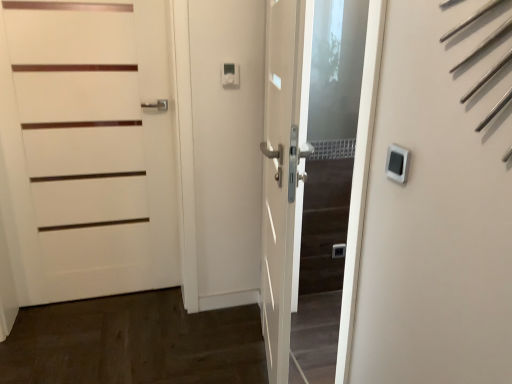
Question: Considering the positions of white matte door at center, the second door in the left-to-right sequence, and white plastic thermostat at upper right in the image, is white matte door at center, the second door in the left-to-right sequence, taller or shorter than white plastic thermostat at upper right?

Choices:
 (A) short
 (B) tall

Answer: (B)

Question: In terms of size, does white matte door at center, the second door in the left-to-right sequence, appear bigger or smaller than white plastic thermostat at upper right?

Choices:
 (A) small
 (B) big

Answer: (B)

Question: Estimate the real-world distances between objects in this image. Which object is farther from the white plastic thermostat at upper right?

Choices:
 (A) white matte door at center
 (B) white matte door at left, the 1th door from the left
 (C) white matte door at center, the 1th door positioned from the right

Answer: (B)

Question: Which object is the closest to the white plastic thermostat at upper right?

Choices:
 (A) white matte door at center
 (B) white matte door at center, the 1th door positioned from the right
 (C) white matte door at left, the 1th door from the left

Answer: (B)